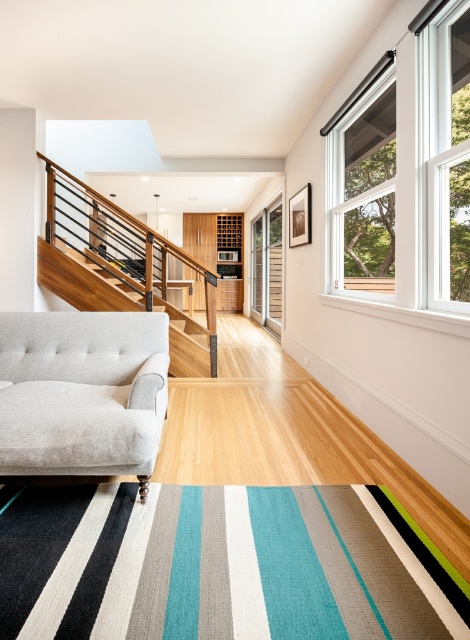
Question: Does light gray fabric couch at lower left have a larger size compared to wooden balustrade at upper left?

Choices:
 (A) yes
 (B) no

Answer: (B)

Question: Does white wood window at upper right appear on the right side of light gray fabric couch at lower left?

Choices:
 (A) no
 (B) yes

Answer: (B)

Question: Can you confirm if white wood window at upper right is positioned to the left of light gray fabric couch at lower left?

Choices:
 (A) yes
 (B) no

Answer: (B)

Question: Among these points, which one is farthest from the camera?

Choices:
 (A) (87, 470)
 (B) (352, 154)
 (C) (76, 196)

Answer: (C)

Question: Considering the real-world distances, which object is farthest from the light gray fabric couch at lower left?

Choices:
 (A) white wood window at upper right
 (B) wooden balustrade at upper left

Answer: (B)

Question: Considering the real-world distances, which object is closest to the wooden balustrade at upper left?

Choices:
 (A) light gray fabric couch at lower left
 (B) white wood window at upper right

Answer: (A)